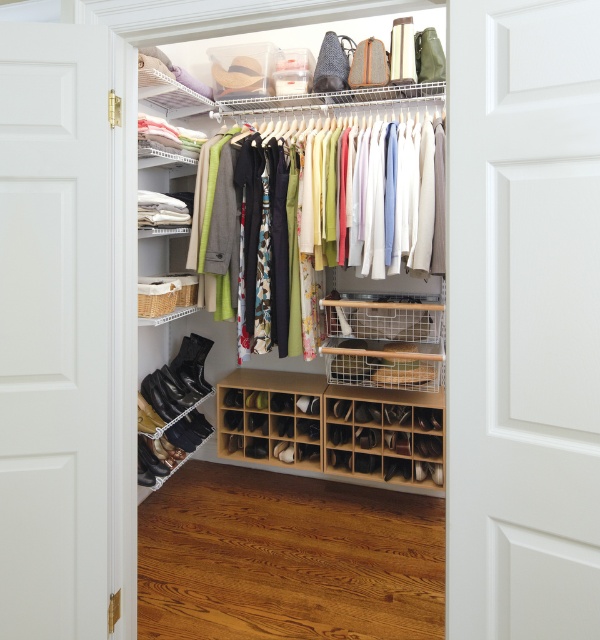
You are moving a pair of shoes that are 30 cm in length. You want to place them in the closet. Which object between the wooden shoe rack at lower center and the wooden shoe organizer at lower center can accommodate the shoes without overlapping with other items?

The wooden shoe rack at lower center has a larger size compared to the wooden shoe organizer at lower center, so it can accommodate the shoes without overlapping with other items.

You are standing in front of the walk in closet and see two points marked as point (471, 236) and point (322, 451). Which point is closer to you?

Point (471, 236) is in front of point (322, 451), so it is closer to you.

You are standing in the walk in closet and want to place a pair of shoes on the wooden shoe rack at lower center. Where should you place them?

The wooden shoe rack at lower center is located at the coordinates point (330, 426), so you should place the shoes there.